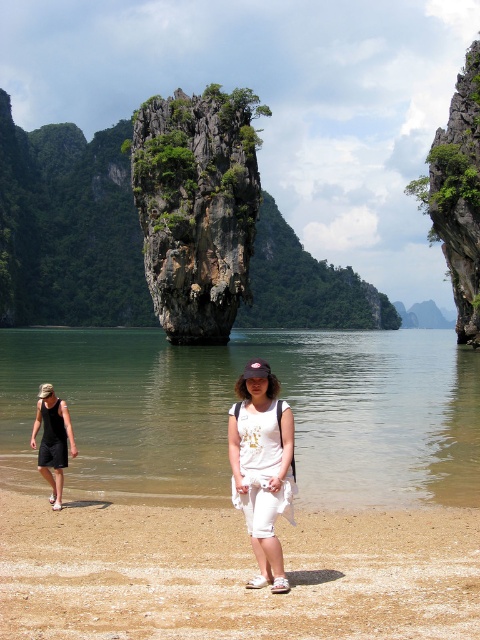
Question: Is white cotton shorts at center above green rocky cliff at right?

Choices:
 (A) no
 (B) yes

Answer: (A)

Question: Is green rocky cliff at right wider than black fabric shorts at lower left?

Choices:
 (A) yes
 (B) no

Answer: (A)

Question: Which of the following is the closest to the observer?

Choices:
 (A) (367, 612)
 (B) (279, 456)
 (C) (441, 492)
 (D) (251, 100)

Answer: (A)

Question: Which of the following is the farthest from the observer?

Choices:
 (A) (421, 380)
 (B) (464, 589)
 (C) (166, 144)

Answer: (C)

Question: Is white cotton shorts at center bigger than green rocky cliff at right?

Choices:
 (A) yes
 (B) no

Answer: (B)

Question: Among these objects, which one is farthest from the camera?

Choices:
 (A) green rocky cliff at right
 (B) black fabric shorts at lower left
 (C) brown sandy beach at lower center
 (D) green mossy rock at center

Answer: (D)